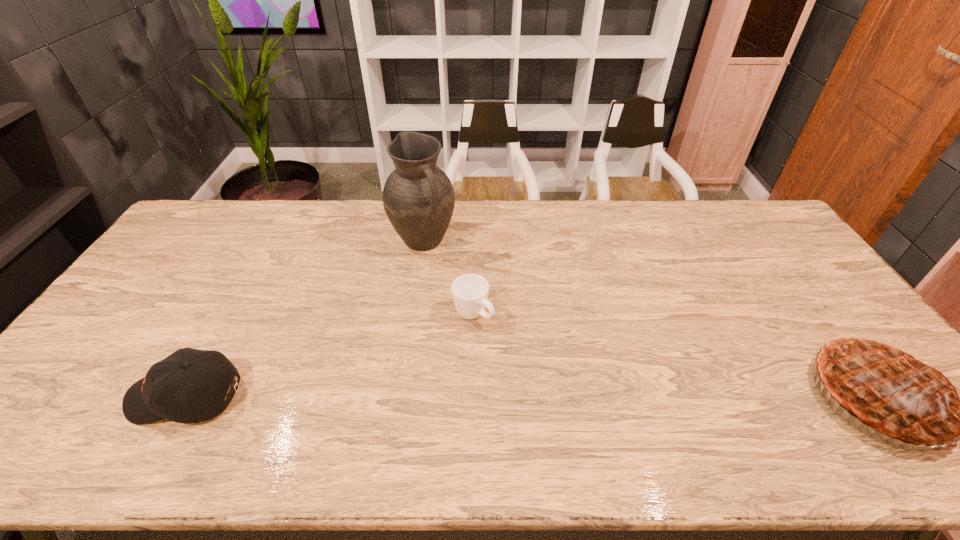
Find the location of a particular element. The image size is (960, 540). free space between the third object from left to right and the tallest object is located at coordinates (448, 278).

Locate an element on the screen. blank region between the third tallest object and the farthest object is located at coordinates (304, 319).

At what (x,y) coordinates should I click in order to perform the action: click on vacant area that lies between the leftmost object and the pitcher. Please return your answer as a coordinate pair (x, y). This screenshot has width=960, height=540. Looking at the image, I should click on (304, 319).

This screenshot has width=960, height=540. I want to click on free space between the tallest object and the shortest object, so click(x=448, y=278).

Identify which object is the nearest to the pitcher. Please provide its 2D coordinates. Your answer should be formatted as a tuple, i.e. [(x, y)], where the tuple contains the x and y coordinates of a point satisfying the conditions above.

[(470, 292)]

The width and height of the screenshot is (960, 540). In order to click on object that is the third closest one to the tallest object in this screenshot , I will do `click(898, 389)`.

The height and width of the screenshot is (540, 960). Identify the location of vacant space that satisfies the following two spatial constraints: 1. on the front side of the pitcher; 2. on the left side of the third object from left to right. (412, 315).